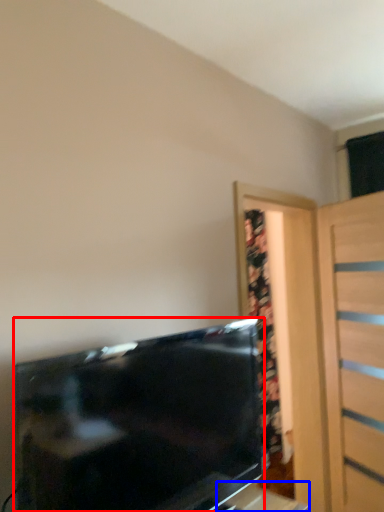
Question: Which object appears farthest to the camera in this image, television (highlighted by a red box) or table (highlighted by a blue box)?

Choices:
 (A) television
 (B) table

Answer: (B)